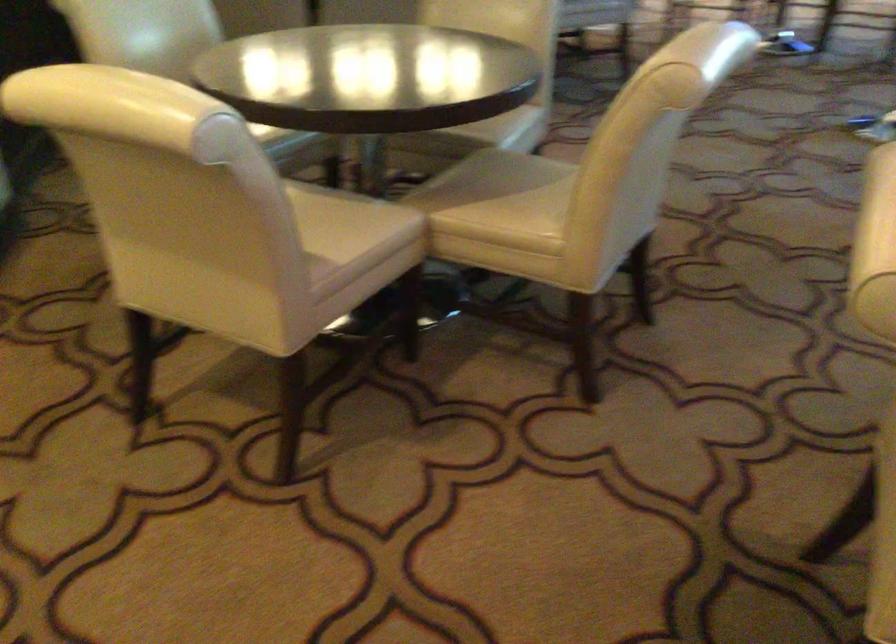
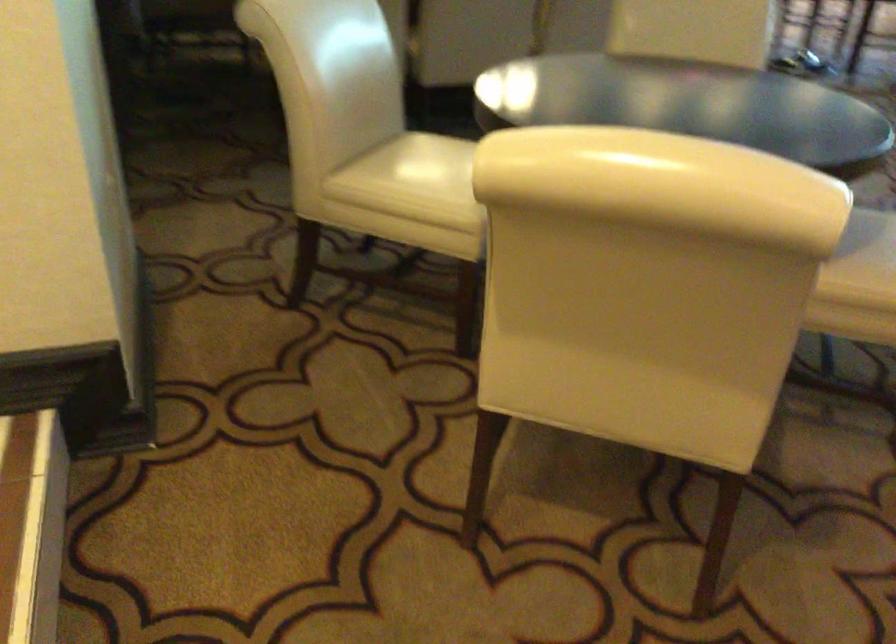
What movement of the cameraman would produce the second image?

The cameraman moved toward left, forward.